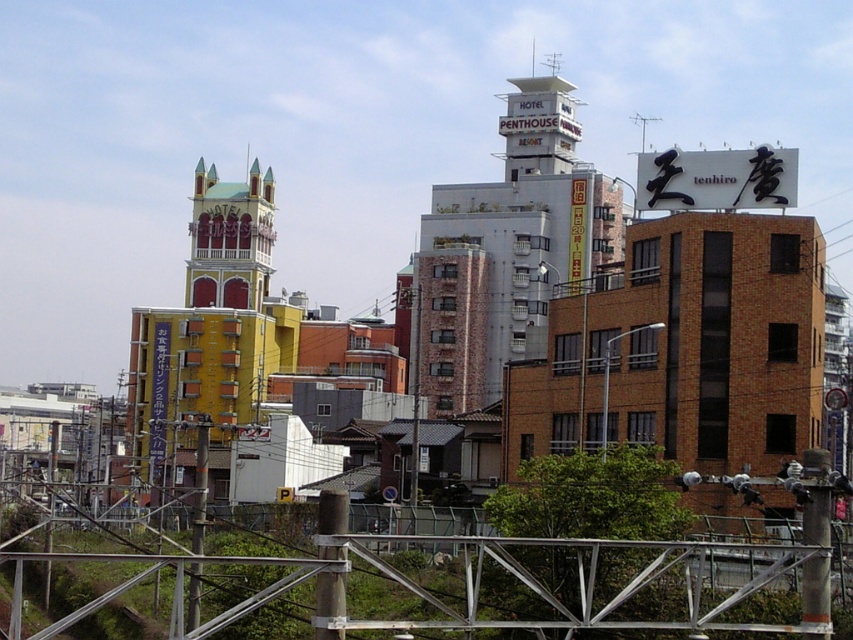
Question: Is white brick building at center thinner than yellow matte building at center?

Choices:
 (A) no
 (B) yes

Answer: (A)

Question: Does metallic gray rail at bottom have a larger size compared to yellow matte building at center?

Choices:
 (A) no
 (B) yes

Answer: (A)

Question: Which object is farther from the camera taking this photo?

Choices:
 (A) yellow matte building at center
 (B) metallic gray rail at bottom

Answer: (A)

Question: Does metallic gray rail at bottom have a lesser width compared to yellow matte building at center?

Choices:
 (A) no
 (B) yes

Answer: (A)

Question: Which point is closer to the camera?

Choices:
 (A) (258, 355)
 (B) (442, 259)
 (C) (701, 554)

Answer: (C)

Question: Among these objects, which one is farthest from the camera?

Choices:
 (A) metallic gray rail at bottom
 (B) yellow matte building at center
 (C) white brick building at center

Answer: (C)